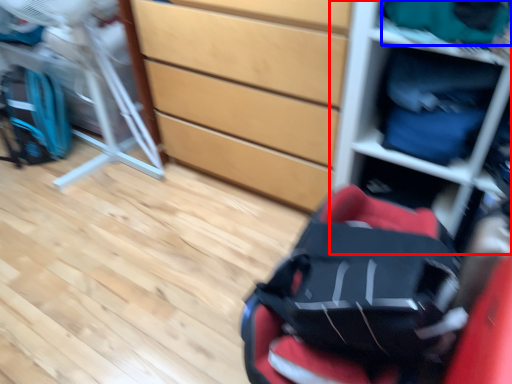
Question: Which of the following is the farthest to the observer, shelf (highlighted by a red box) or clothing (highlighted by a blue box)?

Choices:
 (A) shelf
 (B) clothing

Answer: (B)